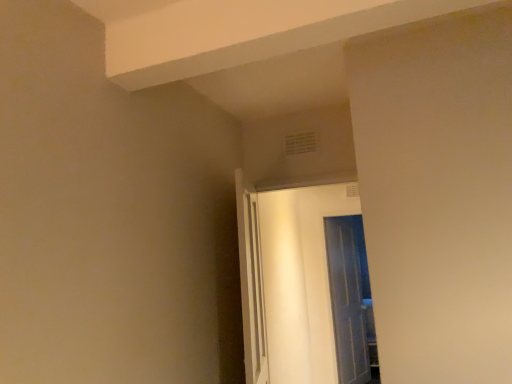
At what (x,y) coordinates should I click in order to perform the action: click on white glossy door at center, which is the 1th door in front-to-back order. Please return your answer as a coordinate pair (x, y). The height and width of the screenshot is (384, 512). Looking at the image, I should click on click(288, 281).

This screenshot has height=384, width=512. Describe the element at coordinates (288, 281) in the screenshot. I see `white glossy door at center, which is the second door from back to front` at that location.

Describe the element at coordinates (347, 301) in the screenshot. This screenshot has width=512, height=384. I see `clear glass door at center, placed as the 2th door when sorted from left to right` at that location.

At what (x,y) coordinates should I click in order to perform the action: click on clear glass door at center, placed as the 2th door when sorted from left to right. Please return your answer as a coordinate pair (x, y). This screenshot has width=512, height=384. Looking at the image, I should click on (347, 301).

What is the approximate width of clear glass door at center, positioned as the 1th door in back-to-front order?

clear glass door at center, positioned as the 1th door in back-to-front order, is 4.65 inches in width.

In order to face clear glass door at center, positioned as the 1th door in back-to-front order, should I rotate leftwards or rightwards?

You should rotate right by 12.581 degrees.

At what (x,y) coordinates should I click in order to perform the action: click on white glossy door at center, the 2th door from the right. Please return your answer as a coordinate pair (x, y). Image resolution: width=512 pixels, height=384 pixels. Looking at the image, I should click on pos(288,281).

Which is more to the left, clear glass door at center, acting as the second door starting from the front, or white glossy door at center, the 2th door from the right?

white glossy door at center, the 2th door from the right, is more to the left.

In the image, is clear glass door at center, positioned as the 1th door in back-to-front order, positioned in front of or behind white glossy door at center, the 2th door from the right?

clear glass door at center, positioned as the 1th door in back-to-front order, is positioned farther from the viewer than white glossy door at center, the 2th door from the right.

Is point (351, 373) closer to camera compared to point (255, 324)?

No, it is not.

From the image's perspective, between clear glass door at center, acting as the 1th door starting from the right, and white glossy door at center, which is counted as the first door, starting from the left, who is located below?

From the image's view, clear glass door at center, acting as the 1th door starting from the right, is below.

From a real-world perspective, between clear glass door at center, acting as the second door starting from the front, and white glossy door at center, which is the 1th door in front-to-back order, who is vertically lower?

clear glass door at center, acting as the second door starting from the front, from a real-world perspective.

Considering the relative sizes of clear glass door at center, acting as the 1th door starting from the right, and white glossy door at center, which is the 1th door in front-to-back order, in the image provided, is clear glass door at center, acting as the 1th door starting from the right, thinner than white glossy door at center, which is the 1th door in front-to-back order,?

Correct, the width of clear glass door at center, acting as the 1th door starting from the right, is less than that of white glossy door at center, which is the 1th door in front-to-back order.

Can you confirm if clear glass door at center, acting as the second door starting from the front, is shorter than white glossy door at center, the 2th door from the right?

Incorrect, the height of clear glass door at center, acting as the second door starting from the front, does not fall short of that of white glossy door at center, the 2th door from the right.

Between clear glass door at center, positioned as the 1th door in back-to-front order, and white glossy door at center, which is the 1th door in front-to-back order, which one has larger size?

With larger size is clear glass door at center, positioned as the 1th door in back-to-front order.

Would you say clear glass door at center, positioned as the 1th door in back-to-front order, is outside white glossy door at center, which is counted as the first door, starting from the left?

Yes, clear glass door at center, positioned as the 1th door in back-to-front order, is located beyond the bounds of white glossy door at center, which is counted as the first door, starting from the left.

Is clear glass door at center, placed as the 2th door when sorted from left to right, touching white glossy door at center, which is counted as the first door, starting from the left?

No, clear glass door at center, placed as the 2th door when sorted from left to right, is not next to white glossy door at center, which is counted as the first door, starting from the left.

Is clear glass door at center, acting as the second door starting from the front, oriented away from white glossy door at center, the 2th door from the right?

That's not correct — clear glass door at center, acting as the second door starting from the front, is not looking away from white glossy door at center, the 2th door from the right.

How distant is clear glass door at center, acting as the 1th door starting from the right, from white glossy door at center, the 2th door from the right?

31.98 inches.

In the image, there is a white glossy door at center, which is counted as the first door, starting from the left. In order to click on door below it (from the image's perspective) in this screenshot , I will do `click(347, 301)`.

Is white glossy door at center, the 2th door from the right, at the right side of clear glass door at center, acting as the 1th door starting from the right?

In fact, white glossy door at center, the 2th door from the right, is to the left of clear glass door at center, acting as the 1th door starting from the right.

Which object is further away from the camera, white glossy door at center, which is the 1th door in front-to-back order, or clear glass door at center, placed as the 2th door when sorted from left to right?

clear glass door at center, placed as the 2th door when sorted from left to right, is behind.

Between point (338, 212) and point (348, 306), which one is positioned behind?

Positioned behind is point (338, 212).

From the image's perspective, is white glossy door at center, the 2th door from the right, beneath clear glass door at center, positioned as the 1th door in back-to-front order?

Actually, white glossy door at center, the 2th door from the right, appears above clear glass door at center, positioned as the 1th door in back-to-front order, in the image.

From a real-world perspective, which object rests below the other?

clear glass door at center, acting as the second door starting from the front, is physically lower.

Which of these two, white glossy door at center, the 2th door from the right, or clear glass door at center, acting as the 1th door starting from the right, is thinner?

clear glass door at center, acting as the 1th door starting from the right, is thinner.

Who is taller, white glossy door at center, the 2th door from the right, or clear glass door at center, acting as the 1th door starting from the right?

Standing taller between the two is clear glass door at center, acting as the 1th door starting from the right.

Does white glossy door at center, which is the second door from back to front, have a smaller size compared to clear glass door at center, placed as the 2th door when sorted from left to right?

Indeed, white glossy door at center, which is the second door from back to front, has a smaller size compared to clear glass door at center, placed as the 2th door when sorted from left to right.

Is clear glass door at center, acting as the 1th door starting from the right, completely or partially inside white glossy door at center, which is counted as the first door, starting from the left?

That's incorrect, clear glass door at center, acting as the 1th door starting from the right, is not inside white glossy door at center, which is counted as the first door, starting from the left.

Is white glossy door at center, which is the second door from back to front, beside clear glass door at center, positioned as the 1th door in back-to-front order?

No, white glossy door at center, which is the second door from back to front, is not touching clear glass door at center, positioned as the 1th door in back-to-front order.

Is white glossy door at center, the 2th door from the right, turned away from clear glass door at center, acting as the second door starting from the front?

Yes.

Based on the photo, can you tell me how much white glossy door at center, which is the 1th door in front-to-back order, and clear glass door at center, positioned as the 1th door in back-to-front order, differ in facing direction?

There is a 71.8-degree angle between the facing directions of white glossy door at center, which is the 1th door in front-to-back order, and clear glass door at center, positioned as the 1th door in back-to-front order.

Locate an element on the screen. door that appears in front of the clear glass door at center, acting as the 1th door starting from the right is located at coordinates (288, 281).

The image size is (512, 384). In order to click on door in front of the clear glass door at center, placed as the 2th door when sorted from left to right in this screenshot , I will do `click(288, 281)`.

Find the location of `door on the left of clear glass door at center, acting as the second door starting from the front`. door on the left of clear glass door at center, acting as the second door starting from the front is located at coordinates (288, 281).